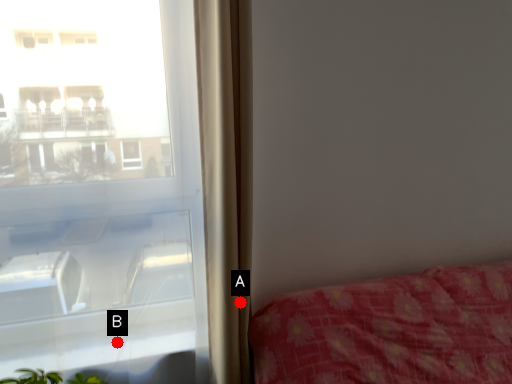
Question: Two points are circled on the image, labeled by A and B beside each circle. Which point is closer to the camera?

Choices:
 (A) A is closer
 (B) B is closer

Answer: (A)